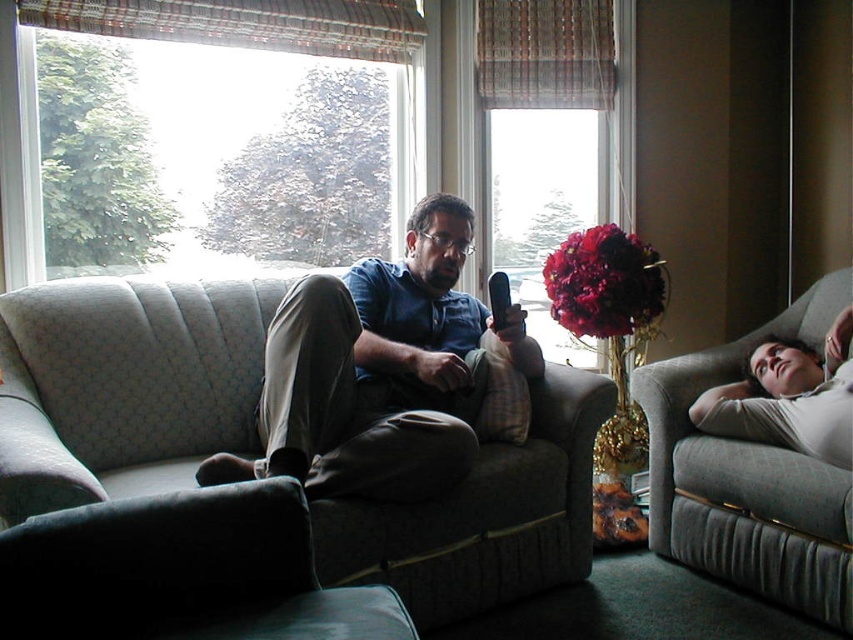
You are standing in the living room and want to place a small potted plant between the two points, point (386, 531) and point (622, 250). Which point should the plant be closer to in order to be nearer to the viewer?

The plant should be placed closer to point (386, 531) because it is closer to the viewer than point (622, 250).

In the living room scene, there is a matte blue shirt at center and a gray fabric couch at right. Which object is positioned to the left of the other?

The matte blue shirt at center is to the left of the gray fabric couch at right.